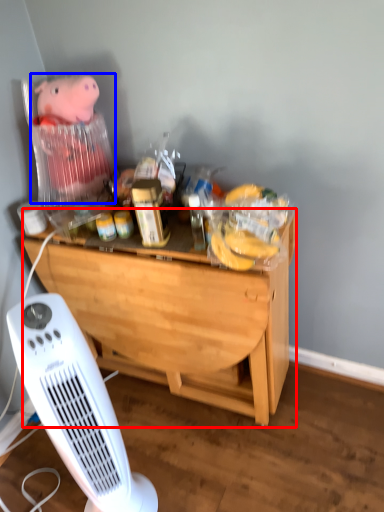
Question: Which point is closer to the camera, desk (highlighted by a red box) or toy (highlighted by a blue box)?

Choices:
 (A) desk
 (B) toy

Answer: (A)